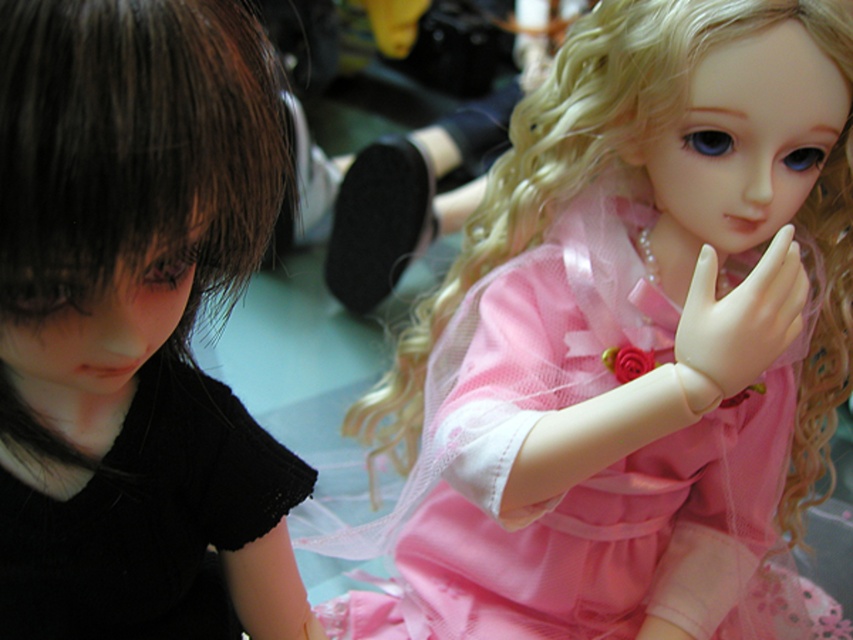
Question: Which point is farther to the camera?

Choices:
 (A) pyautogui.click(x=300, y=484)
 (B) pyautogui.click(x=209, y=628)
 (C) pyautogui.click(x=821, y=64)

Answer: (B)

Question: In this image, where is matte black doll at left located relative to white matte hand at center?

Choices:
 (A) right
 (B) left

Answer: (B)

Question: Is matte pink fabric doll at center thinner than matte black doll at left?

Choices:
 (A) no
 (B) yes

Answer: (A)

Question: Is matte black doll at left to the right of black lace dress at left from the viewer's perspective?

Choices:
 (A) yes
 (B) no

Answer: (A)

Question: Which of the following is the closest to the observer?

Choices:
 (A) matte pink fabric doll at center
 (B) black lace dress at left
 (C) matte black doll at left
 (D) white matte hand at center

Answer: (C)

Question: Which point is closer to the camera?

Choices:
 (A) (207, 403)
 (B) (532, 560)
 (C) (704, 280)

Answer: (C)